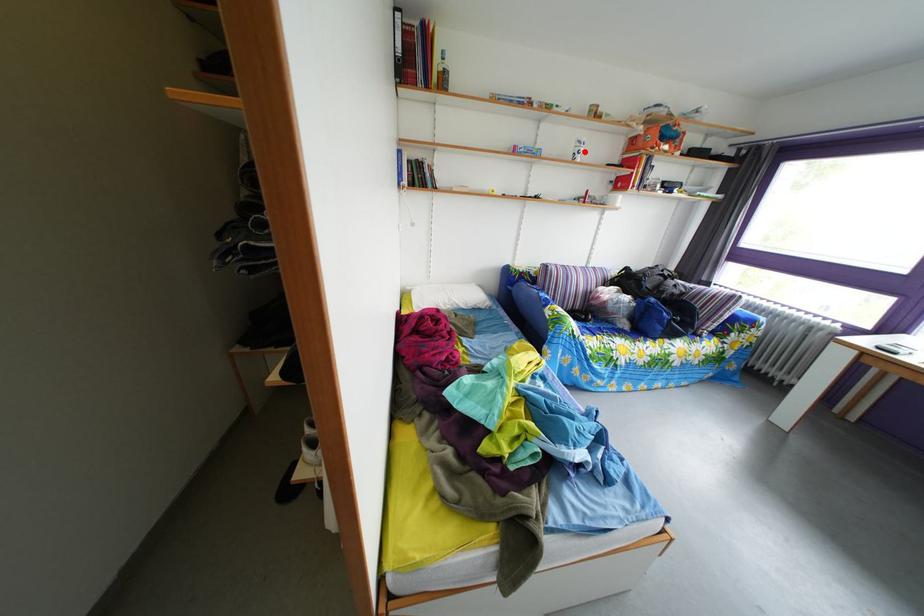
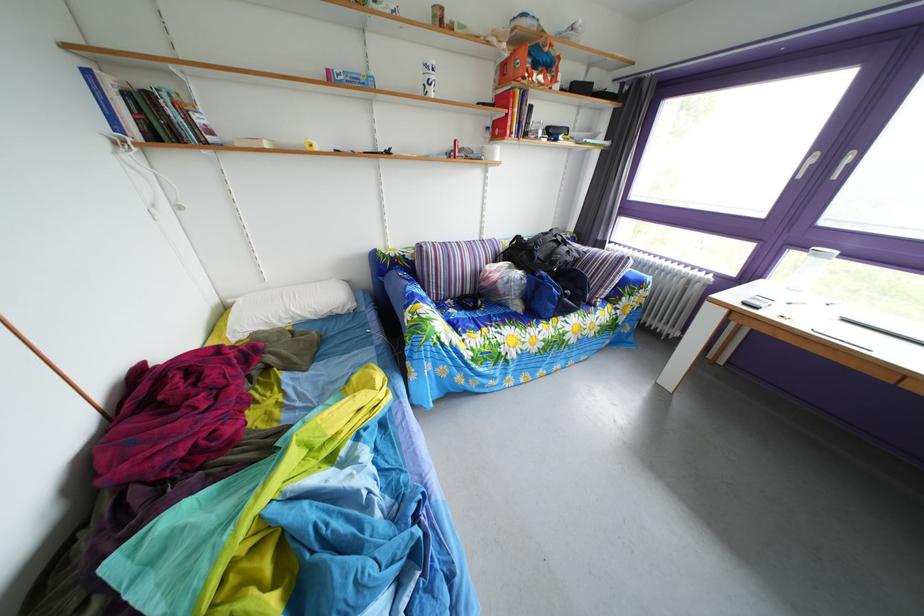
Locate, in the second image, the point that corresponds to the highlighted location in the first image.

(432, 79)